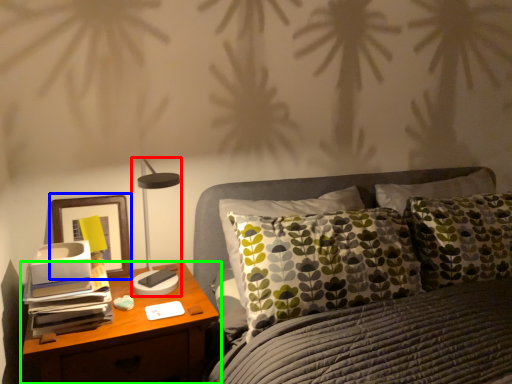
Question: Which object is the farthest from table lamp (highlighted by a red box)? Choose among these: picture frame (highlighted by a blue box) or nightstand (highlighted by a green box).

Choices:
 (A) picture frame
 (B) nightstand

Answer: (B)